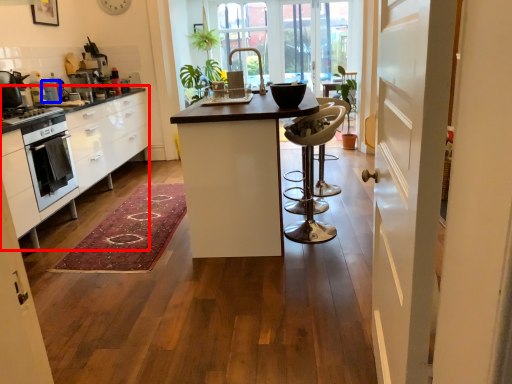
Question: Among these objects, which one is nearest to the camera, cabinetry (highlighted by a red box) or appliance (highlighted by a blue box)?

Choices:
 (A) cabinetry
 (B) appliance

Answer: (A)